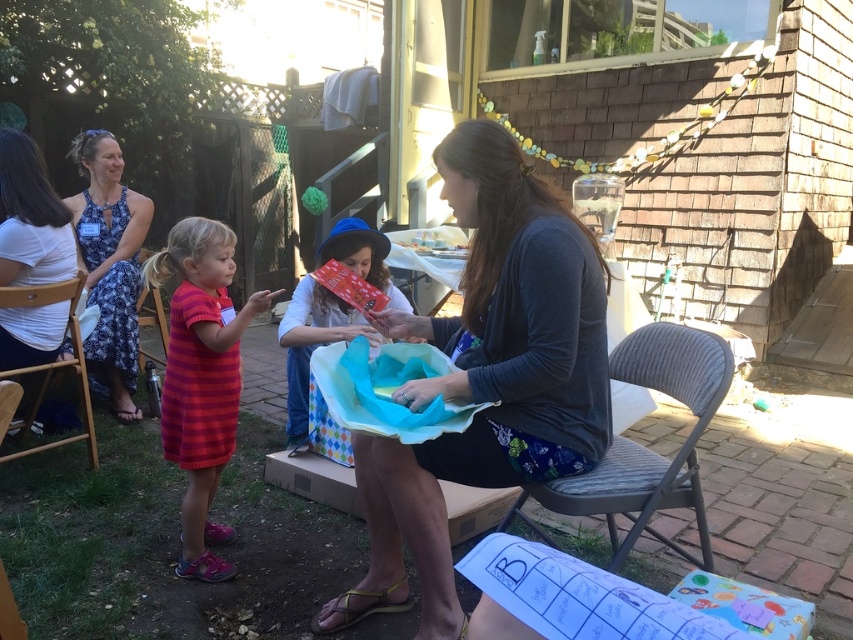
You are standing in the backyard and want to reach the point marked as point [335,259]. If you take a step forward of 1 meter, how far will you be from the point?

The point [335,259] is 2.73 meters away from the viewer. After taking a step forward of 1 meter, the remaining distance to the point would be 1.73 meters.

You are a photographer setting up for a group photo. You need to position the striped knit dress at left and the wooden chair at lower left in the frame. Based on their sizes, which object should you place closer to the camera to maintain their relative sizes in the photo?

The striped knit dress at left is taller than the wooden chair at lower left, so to maintain their relative sizes in the photo, you should place the wooden chair at lower left closer to the camera since it is shorter.